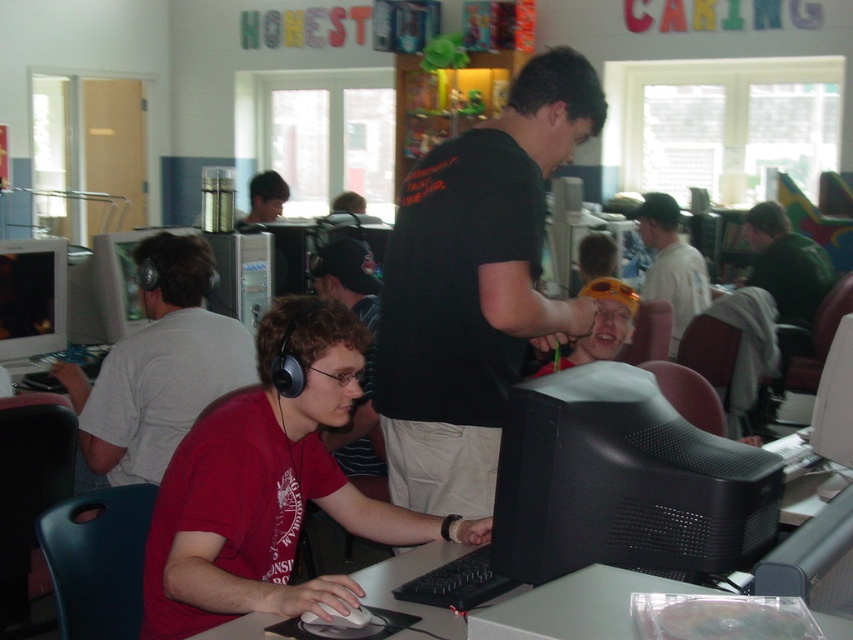
Question: Which of the following is the farthest from the observer?

Choices:
 (A) (184, 262)
 (B) (711, 522)
 (C) (35, 262)
 (D) (247, 216)

Answer: (D)

Question: Does black matte monitor at center have a greater width compared to matte orange sunglasses at center?

Choices:
 (A) yes
 (B) no

Answer: (A)

Question: Which object is the closest to the white matte mouse at lower center?

Choices:
 (A) matte red shirt at center
 (B) black matte monitor at center

Answer: (B)

Question: Does matte black monitor at left have a smaller size compared to matte orange sunglasses at center?

Choices:
 (A) no
 (B) yes

Answer: (B)

Question: Which point is closer to the camera?

Choices:
 (A) white matte mouse at lower center
 (B) black matte shirt at center

Answer: (A)

Question: Considering the relative positions of white plastic table at lower center and matte orange sunglasses at center in the image provided, where is white plastic table at lower center located with respect to matte orange sunglasses at center?

Choices:
 (A) left
 (B) right

Answer: (A)